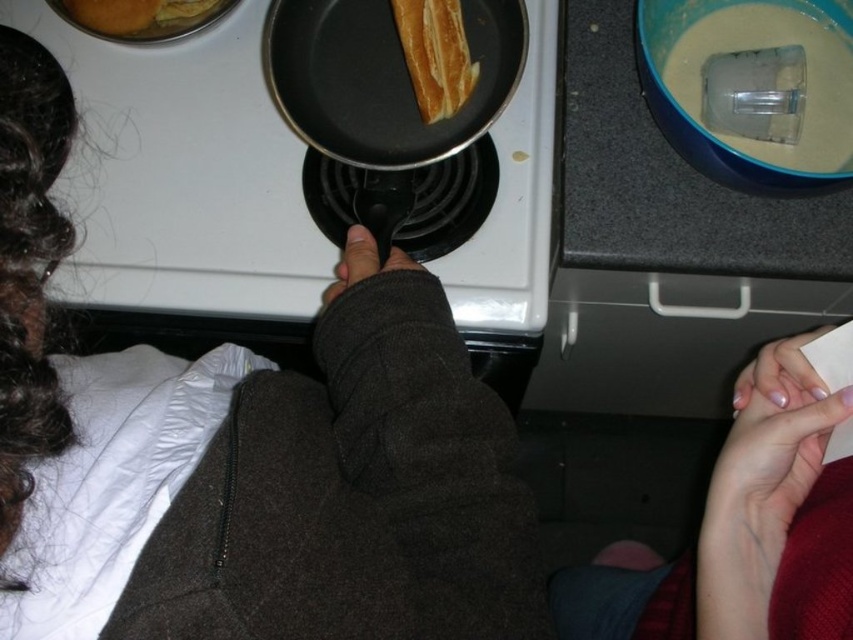
You are a chef trying to locate the exact spot where you placed your special seasoning. You remember placing it at point coordinates (381, 77). Based on the scene, where is this point located?

The point coordinates (381, 77) are on the black nonstick frying pan at center, so the special seasoning is on the frying pan.